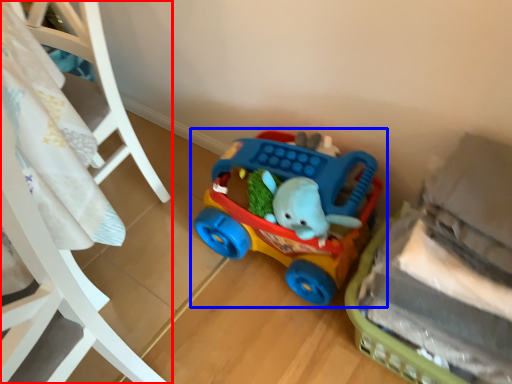
Question: Which object is closer to the camera taking this photo, furniture (highlighted by a red box) or toy (highlighted by a blue box)?

Choices:
 (A) furniture
 (B) toy

Answer: (A)